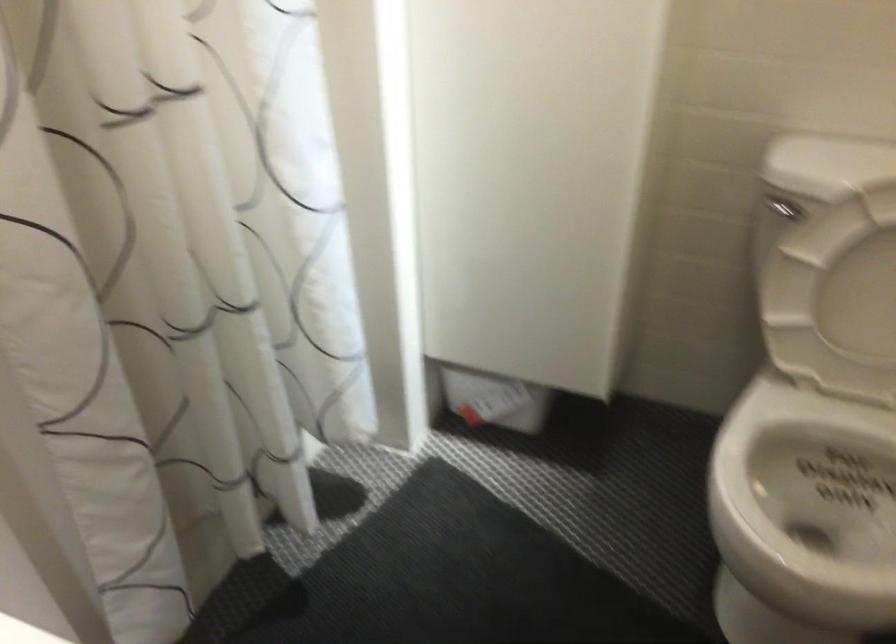
Locate an element on the screen. The height and width of the screenshot is (644, 896). white toilet lid is located at coordinates (833, 292).